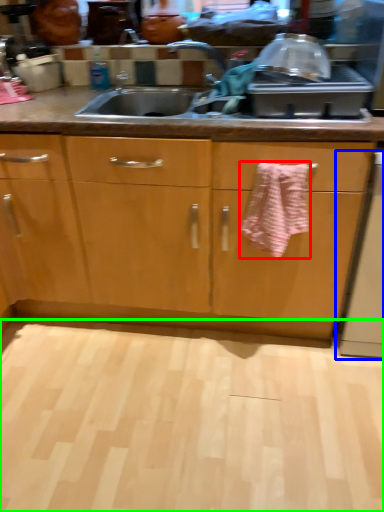
Question: Which is nearer to the bath towel (highlighted by a red box)? dish washer (highlighted by a blue box) or plain (highlighted by a green box).

Choices:
 (A) dish washer
 (B) plain

Answer: (A)